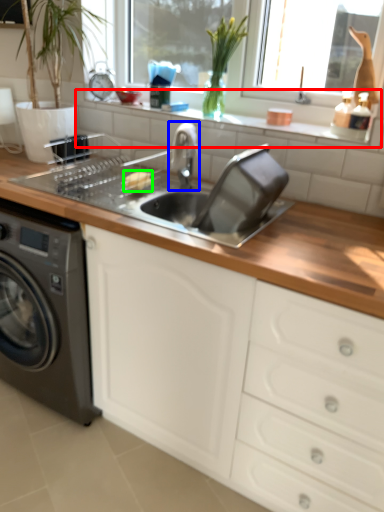
Question: Estimate the real-world distances between objects in this image. Which object is closer to window sill (highlighted by a red box), tap (highlighted by a blue box) or food (highlighted by a green box)?

Choices:
 (A) tap
 (B) food

Answer: (A)